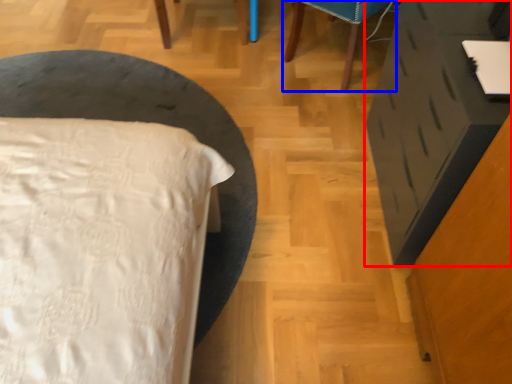
Question: Which point is further to the camera, vanity (highlighted by a red box) or furniture (highlighted by a blue box)?

Choices:
 (A) vanity
 (B) furniture

Answer: (B)